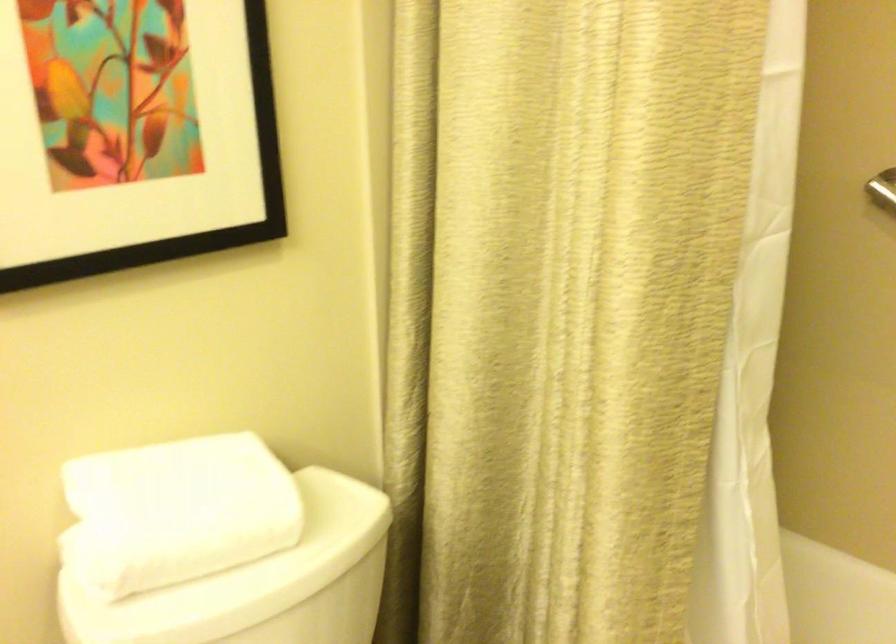
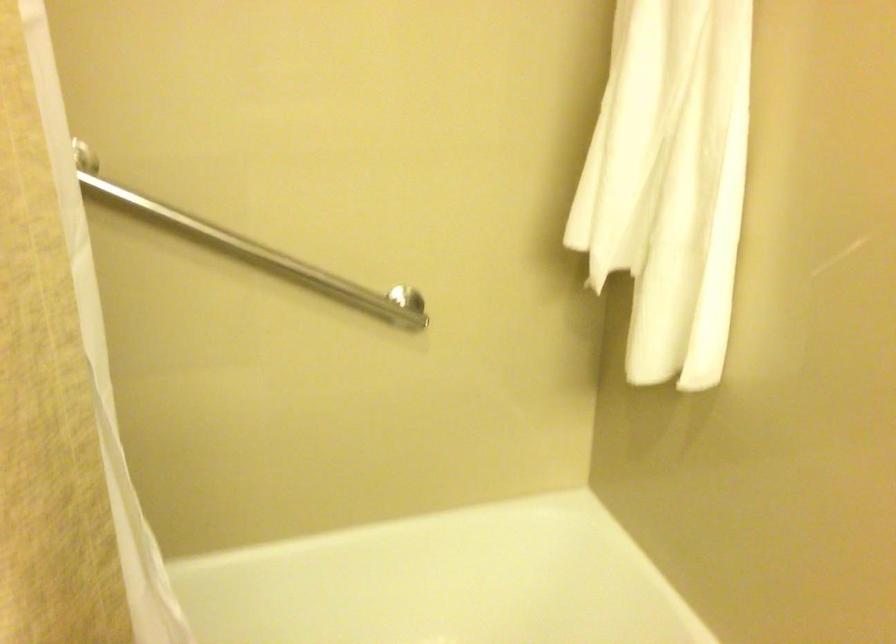
Question: The images are taken continuously from a first-person perspective. In which direction is your viewpoint rotating?

Choices:
 (A) Left
 (B) Right
 (C) Up
 (D) Down

Answer: (B)